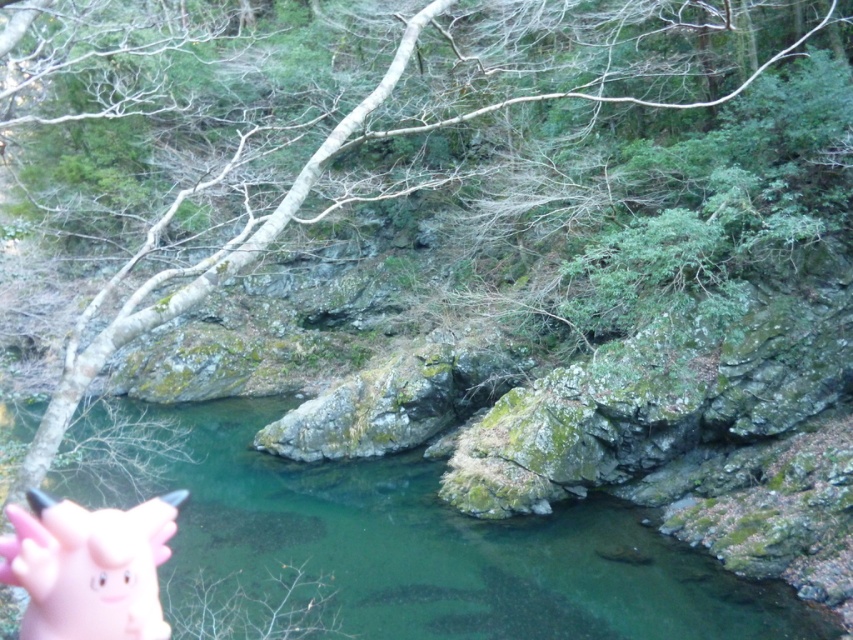
Question: Which of the following is the farthest from the observer?

Choices:
 (A) (3, 564)
 (B) (222, 413)

Answer: (B)

Question: Can you confirm if green mossy rock at center is positioned below pink rubber piggy bank at bottom left?

Choices:
 (A) yes
 (B) no

Answer: (A)

Question: Which point is farther to the camera?

Choices:
 (A) pos(437,628)
 (B) pos(59,614)

Answer: (A)

Question: Is green mossy rock at center wider than pink rubber piggy bank at bottom left?

Choices:
 (A) yes
 (B) no

Answer: (A)

Question: Can you confirm if green mossy rock at center is positioned to the right of pink rubber piggy bank at bottom left?

Choices:
 (A) yes
 (B) no

Answer: (B)